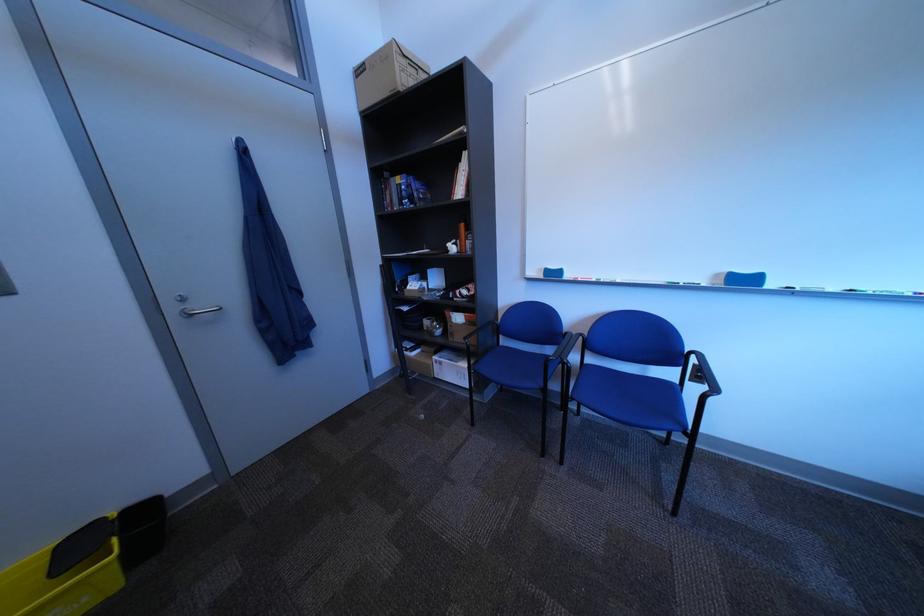
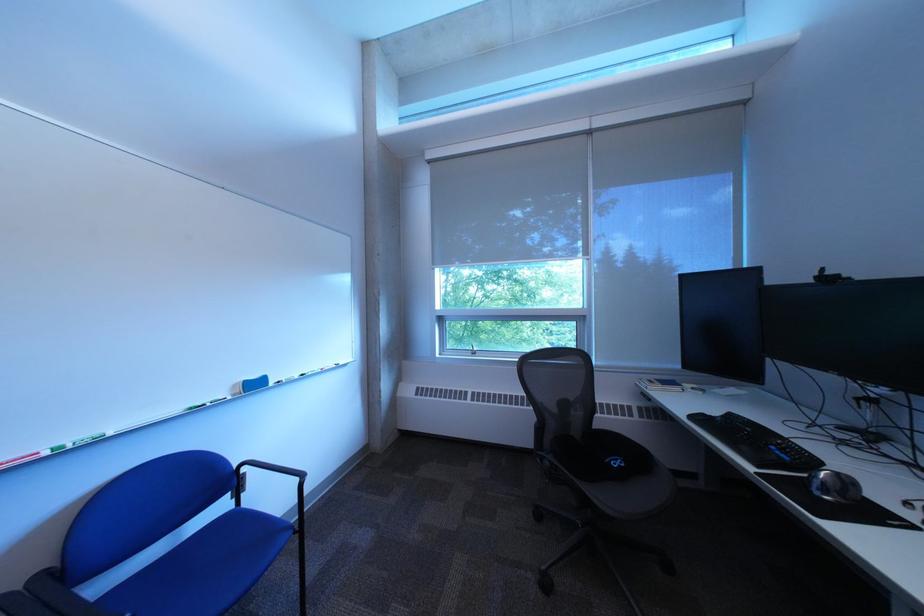
Locate, in the second image, the point that corresponds to the point at 707,354 in the first image.

(257, 467)